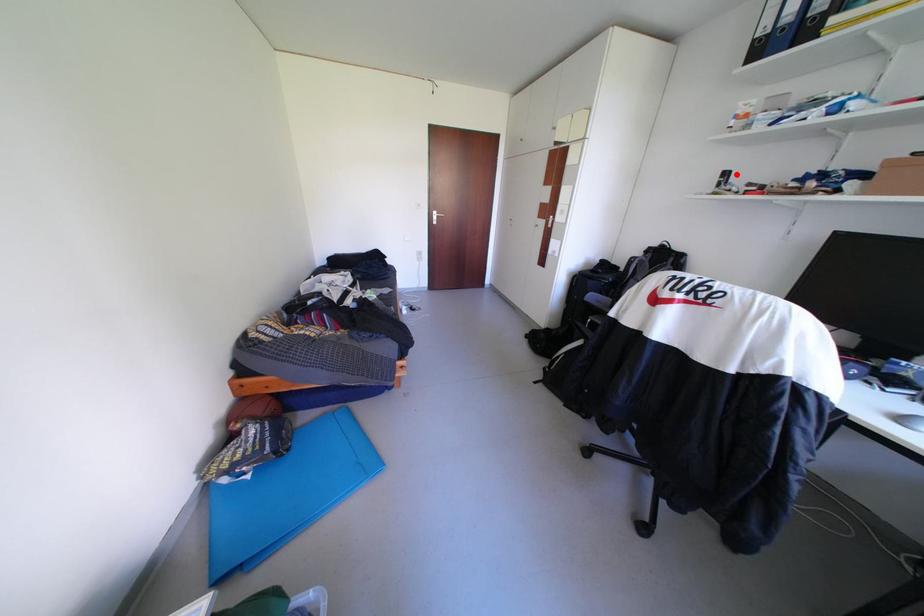
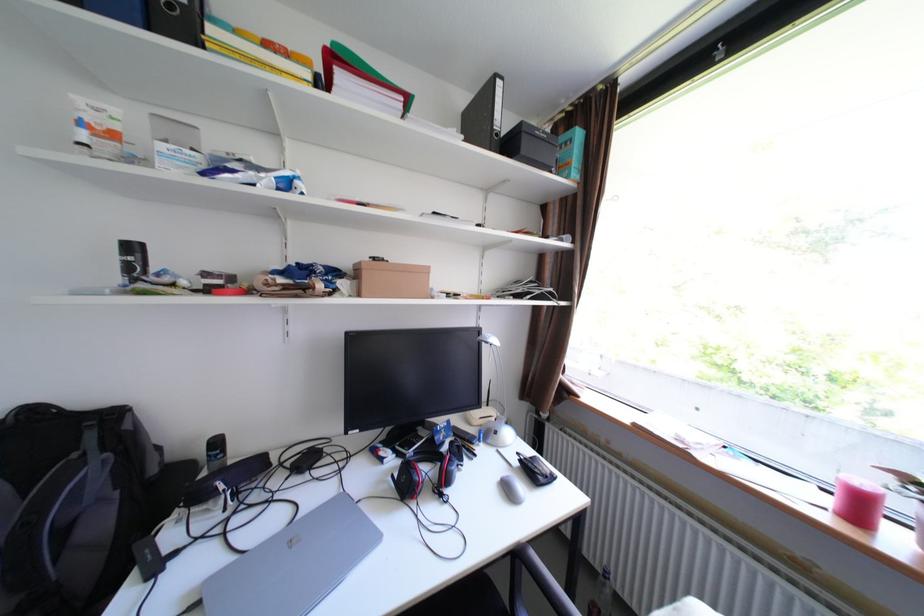
Question: I am providing you with two images of the same scene from different viewpoints. A red point is marked on the first image. Can you still see the location of the red point in image 2?

Choices:
 (A) Yes
 (B) No

Answer: (A)